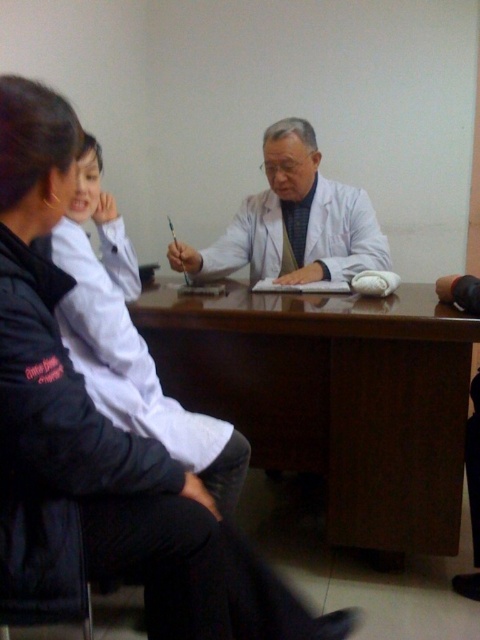
Question: Among these points, which one is nearest to the camera?

Choices:
 (A) (370, 234)
 (B) (112, 262)
 (C) (245, 328)

Answer: (C)

Question: Which point is farther from the camera taking this photo?

Choices:
 (A) (279, 122)
 (B) (216, 451)
 (C) (402, 452)

Answer: (A)

Question: Which object is the closest to the brown wood table at center?

Choices:
 (A) white matte coat at left
 (B) white matte coat at center

Answer: (A)

Question: Is white matte coat at left bigger than white matte coat at center?

Choices:
 (A) yes
 (B) no

Answer: (A)

Question: Does brown wood table at center have a larger size compared to white matte coat at center?

Choices:
 (A) no
 (B) yes

Answer: (B)

Question: Is brown wood table at center below white matte coat at center?

Choices:
 (A) no
 (B) yes

Answer: (B)